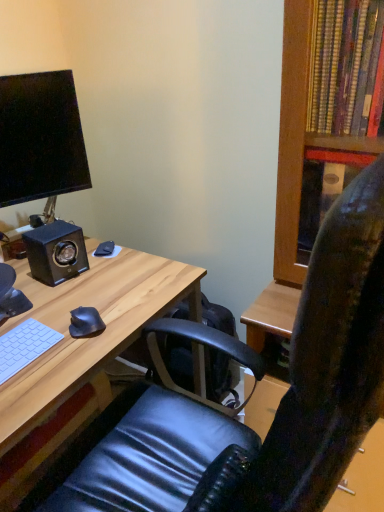
Find the location of a particular element. empty space that is ontop of white matte keyboard at lower left (from a real-world perspective) is located at coordinates (16, 345).